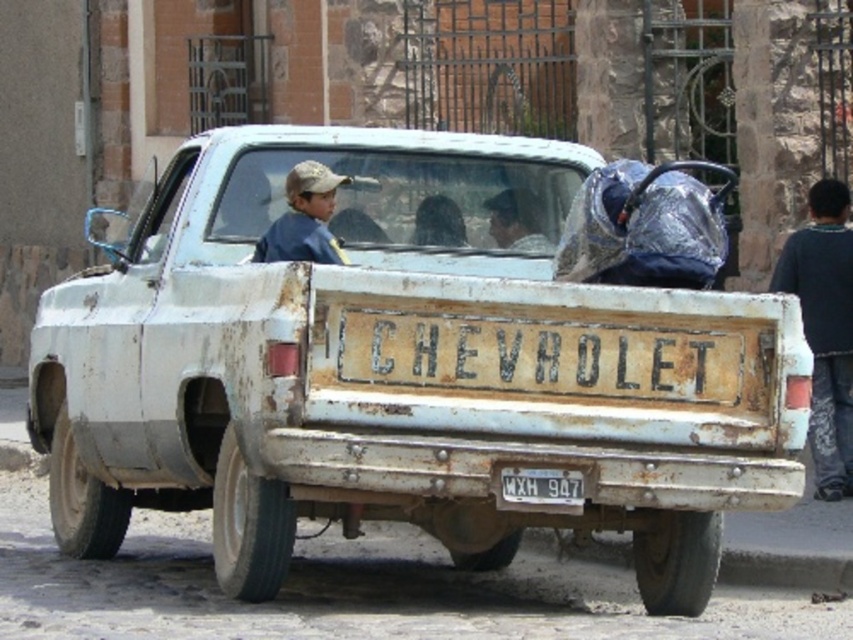
Who is lower down, dark blue fabric at right or white matte license plate at center?

white matte license plate at center

Is point (844, 330) less distant than point (543, 504)?

No, it is behind (543, 504).

This screenshot has width=853, height=640. Identify the location of dark blue fabric at right. (825, 328).

What do you see at coordinates (515, 220) in the screenshot?
I see `dark blue fabric at center` at bounding box center [515, 220].

Which is in front, point (494, 228) or point (572, 492)?

Point (572, 492)

This screenshot has height=640, width=853. Describe the element at coordinates (515, 220) in the screenshot. I see `dark blue fabric at center` at that location.

Identify the location of dark blue fabric at center. The image size is (853, 640). (515, 220).

How distant is dark blue fabric at right from dark blue fabric at center?

The distance of dark blue fabric at right from dark blue fabric at center is 10.18 feet.

Does dark blue fabric at right appear on the left side of dark blue fabric at center?

In fact, dark blue fabric at right is to the right of dark blue fabric at center.

Is point (813, 381) closer to viewer compared to point (527, 216)?

No, (813, 381) is behind (527, 216).

Identify the location of dark blue fabric at right. Image resolution: width=853 pixels, height=640 pixels. [825, 328].